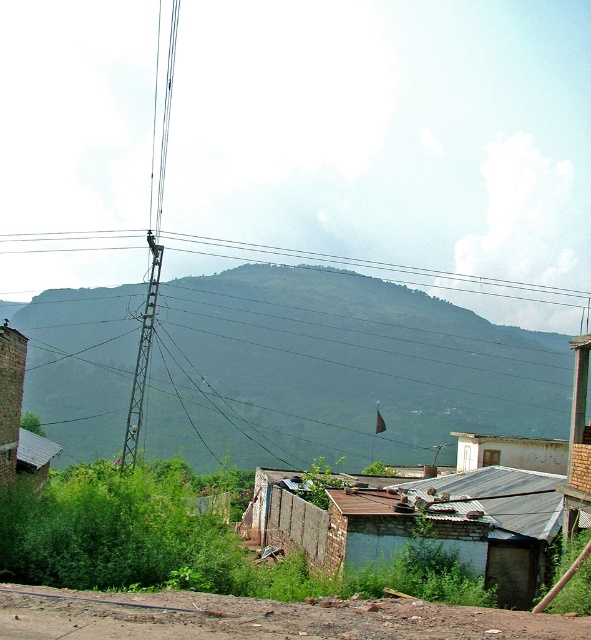
Question: Does rusty corrugated metal hut at lower right appear under brick hut at lower left?

Choices:
 (A) no
 (B) yes

Answer: (B)

Question: Which of the following is the closest to the observer?

Choices:
 (A) metallic tower at center-left
 (B) brick hut at lower left
 (C) metallic wire at upper center
 (D) green grassy hill at center

Answer: (B)

Question: Can you confirm if rusty corrugated metal hut at lower right is thinner than brick hut at lower left?

Choices:
 (A) no
 (B) yes

Answer: (A)

Question: Can you confirm if rusty corrugated metal hut at lower right is positioned to the right of metallic wire at upper center?

Choices:
 (A) no
 (B) yes

Answer: (B)

Question: Which object appears farthest from the camera in this image?

Choices:
 (A) green grassy hill at center
 (B) rusty corrugated metal hut at lower right
 (C) metallic tower at center-left
 (D) metallic wire at upper center

Answer: (D)

Question: Among these points, which one is nearest to the camera?

Choices:
 (A) (8, 372)
 (B) (95, 445)

Answer: (A)